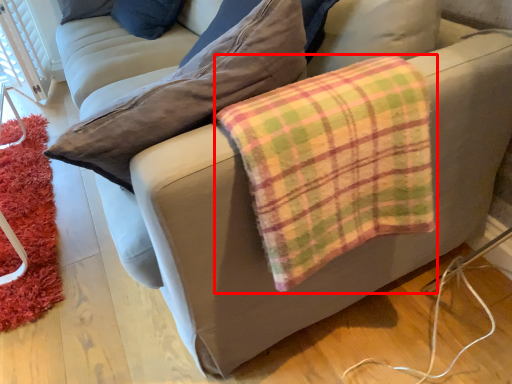
Question: From the image's perspective, considering the relative positions of flannel (annotated by the red box) and mat in the image provided, where is flannel (annotated by the red box) located with respect to the staircase?

Choices:
 (A) below
 (B) above

Answer: (B)